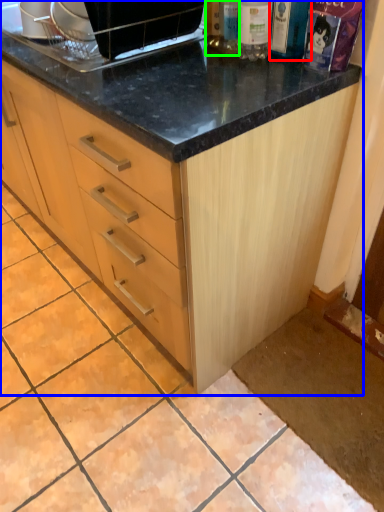
Question: Considering the real-world distances, which object is closest to bottle (highlighted by a red box)? cabinetry (highlighted by a blue box) or bottle (highlighted by a green box).

Choices:
 (A) cabinetry
 (B) bottle

Answer: (B)